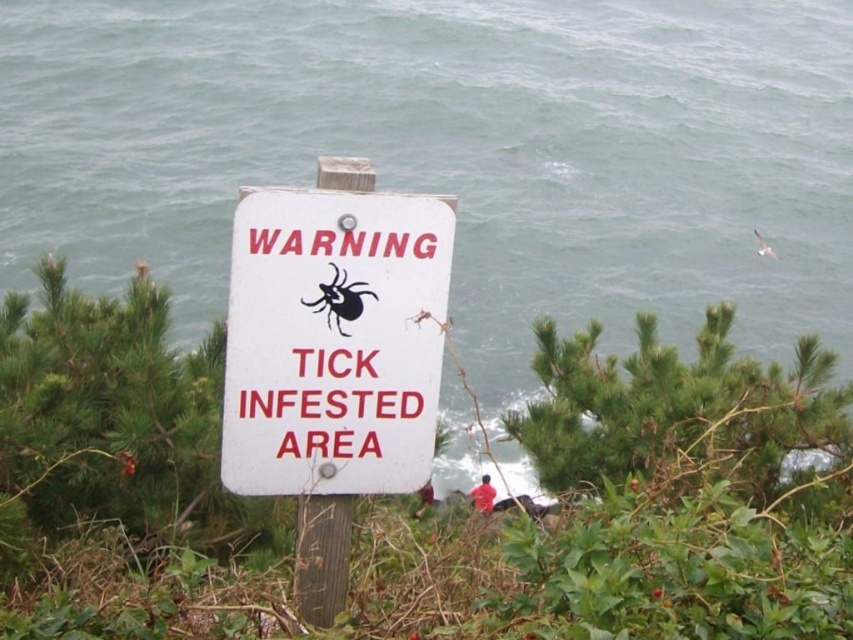
Question: Can you confirm if white plastic sign at center is positioned above black matte/spider at center?

Choices:
 (A) yes
 (B) no

Answer: (B)

Question: Which point is closer to the camera taking this photo?

Choices:
 (A) (230, 362)
 (B) (331, 280)

Answer: (A)

Question: Is white plastic sign at center bigger than black matte/spider at center?

Choices:
 (A) no
 (B) yes

Answer: (B)

Question: Which point is closer to the camera taking this photo?

Choices:
 (A) (259, 278)
 (B) (339, 269)

Answer: (A)

Question: Which of the following is the closest to the observer?

Choices:
 (A) (344, 305)
 (B) (325, 458)

Answer: (A)

Question: Does white plastic sign at center lie in front of black matte/spider at center?

Choices:
 (A) yes
 (B) no

Answer: (A)